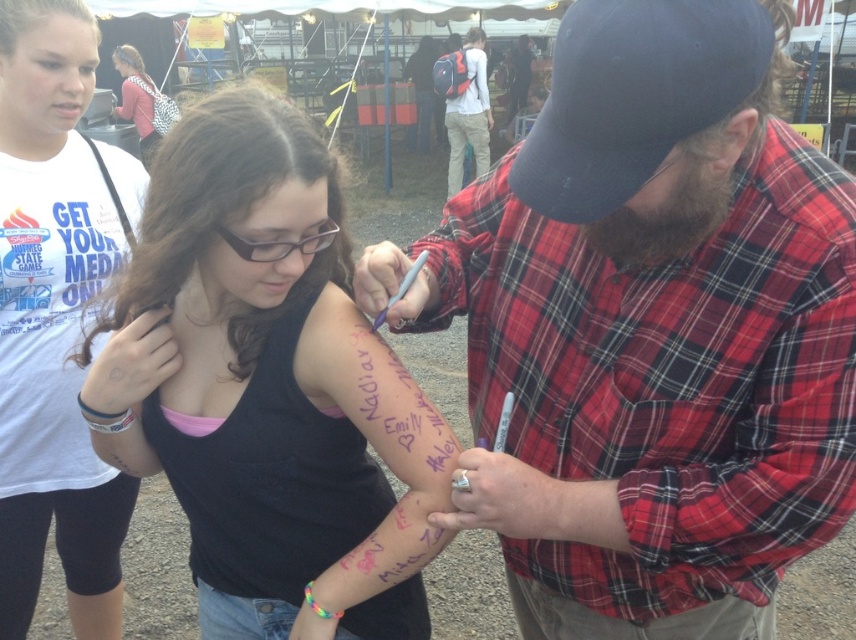
Question: Which object is the closest to the white t-shirt at upper left?

Choices:
 (A) red plaid shirt at center
 (B) matte pink shirt at upper left
 (C) black matte tank top at center
 (D) red plaid shirt at upper center

Answer: (C)

Question: Does white t-shirt at upper left appear under red plaid shirt at upper center?

Choices:
 (A) no
 (B) yes

Answer: (B)

Question: Does red plaid shirt at center appear on the left side of matte pink shirt at upper left?

Choices:
 (A) yes
 (B) no

Answer: (B)

Question: Which object is farther from the camera taking this photo?

Choices:
 (A) red plaid shirt at center
 (B) black matte tank top at center
 (C) matte pink shirt at upper left
 (D) red plaid shirt at upper center

Answer: (D)

Question: Which of these objects is positioned farthest from the red plaid shirt at upper center?

Choices:
 (A) black matte tank top at center
 (B) matte pink shirt at upper left
 (C) white t-shirt at upper left

Answer: (A)

Question: In this image, where is red plaid shirt at upper center located relative to matte pink shirt at upper left?

Choices:
 (A) below
 (B) above

Answer: (B)